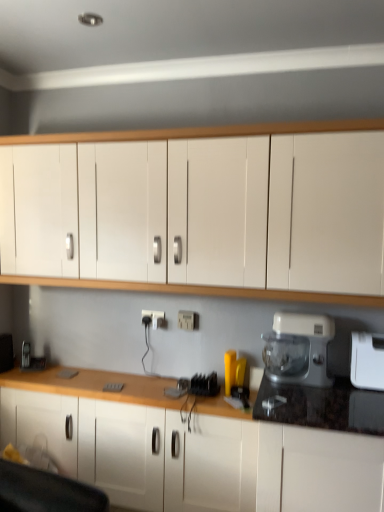
How much space does white plastic electric outlet at center, positioned as the 2th electric outlet in back-to-front order, occupy horizontally?

1.69 inches.

Where is `white plastic electric outlet at center, arranged as the 2th electric outlet when viewed from the right`? white plastic electric outlet at center, arranged as the 2th electric outlet when viewed from the right is located at coordinates (154, 318).

In order to face white plastic food processor at right, should I rotate leftwards or rightwards?

To face it directly, rotate right by 13.960 degrees.

I want to click on white plastic food processor at right, so click(298, 349).

Image resolution: width=384 pixels, height=512 pixels. What do you see at coordinates (189, 448) in the screenshot? I see `white matte cabinet at center, which is counted as the 1th cabinetry, starting from the bottom` at bounding box center [189, 448].

What are the coordinates of `white matte cabinet at upper center, marked as the 2th cabinetry in a bottom-to-top arrangement` in the screenshot? It's located at (229, 215).

At what (x,y) coordinates should I click in order to perform the action: click on white plastic electric outlet at center, which is the 2th electric outlet from left to right. Please return your answer as a coordinate pair (x, y). Looking at the image, I should click on (188, 320).

Is white matte cabinet at center, which is counted as the 2th cabinetry, starting from the top, turned away from white matte cabinet at upper center, marked as the 2th cabinetry in a bottom-to-top arrangement?

That's not correct — white matte cabinet at center, which is counted as the 2th cabinetry, starting from the top, is not looking away from white matte cabinet at upper center, marked as the 2th cabinetry in a bottom-to-top arrangement.

Is white matte cabinet at center, which is counted as the 1th cabinetry, starting from the bottom, far from white matte cabinet at upper center, marked as the 2th cabinetry in a bottom-to-top arrangement?

Actually, white matte cabinet at center, which is counted as the 1th cabinetry, starting from the bottom, and white matte cabinet at upper center, marked as the 2th cabinetry in a bottom-to-top arrangement, are a little close together.

Measure the distance from white matte cabinet at center, which is counted as the 2th cabinetry, starting from the top, to white matte cabinet at upper center, marked as the 2th cabinetry in a bottom-to-top arrangement.

white matte cabinet at center, which is counted as the 2th cabinetry, starting from the top, and white matte cabinet at upper center, marked as the 2th cabinetry in a bottom-to-top arrangement, are 34.29 inches apart.

Does white matte cabinet at center, which is counted as the 2th cabinetry, starting from the top, have a greater height compared to white matte cabinet at upper center, which is the first cabinetry in top-to-bottom order?

In fact, white matte cabinet at center, which is counted as the 2th cabinetry, starting from the top, may be shorter than white matte cabinet at upper center, which is the first cabinetry in top-to-bottom order.

Is white plastic electric outlet at center, the second electric outlet positioned from the front, bigger or smaller than white plastic toaster at right?

In the image, white plastic electric outlet at center, the second electric outlet positioned from the front, appears to be smaller than white plastic toaster at right.

Are white plastic electric outlet at center, the 1th electric outlet viewed from the left, and white plastic toaster at right far apart?

Yes, white plastic electric outlet at center, the 1th electric outlet viewed from the left, and white plastic toaster at right are quite far apart.

Would you say white plastic electric outlet at center, arranged as the 2th electric outlet when viewed from the right, contains white plastic toaster at right?

That's incorrect, white plastic toaster at right is not inside white plastic electric outlet at center, arranged as the 2th electric outlet when viewed from the right.

From the picture: Does white plastic electric outlet at center, arranged as the first electric outlet when viewed from the back, have a greater width compared to white plastic toaster at right?

In fact, white plastic electric outlet at center, arranged as the first electric outlet when viewed from the back, might be narrower than white plastic toaster at right.

Considering the positions of objects white plastic electric outlet at center, arranged as the first electric outlet when viewed from the back, and white plastic electric outlet at center, positioned as the 2th electric outlet in back-to-front order, in the image provided, who is more to the right, white plastic electric outlet at center, arranged as the first electric outlet when viewed from the back, or white plastic electric outlet at center, positioned as the 2th electric outlet in back-to-front order,?

white plastic electric outlet at center, positioned as the 2th electric outlet in back-to-front order, is more to the right.

Is white plastic electric outlet at center, the second electric outlet positioned from the front, completely or partially outside of white plastic electric outlet at center, positioned as the 2th electric outlet in back-to-front order?

Yes, white plastic electric outlet at center, the second electric outlet positioned from the front, is located beyond the bounds of white plastic electric outlet at center, positioned as the 2th electric outlet in back-to-front order.

The width and height of the screenshot is (384, 512). What are the coordinates of `electric outlet positioned vertically above the white plastic electric outlet at center, arranged as the first electric outlet when viewed from the back (from a real-world perspective)` in the screenshot? It's located at (188, 320).

Is white plastic electric outlet at center, the 1th electric outlet viewed from the left, oriented towards white plastic electric outlet at center, which is the 2th electric outlet from left to right?

No, white plastic electric outlet at center, the 1th electric outlet viewed from the left, is not turned towards white plastic electric outlet at center, which is the 2th electric outlet from left to right.

Looking at this image, between white plastic toaster at right and white plastic electric outlet at center, which is the 2th electric outlet from left to right, which one has smaller width?

white plastic electric outlet at center, which is the 2th electric outlet from left to right.

From the image's perspective, between white plastic toaster at right and white plastic electric outlet at center, the 1th electric outlet from the front, which one is located above?

white plastic electric outlet at center, the 1th electric outlet from the front.

Considering the positions of objects white plastic toaster at right and white plastic electric outlet at center, marked as the 1th electric outlet in a right-to-left arrangement, in the image provided, who is more to the left, white plastic toaster at right or white plastic electric outlet at center, marked as the 1th electric outlet in a right-to-left arrangement,?

white plastic electric outlet at center, marked as the 1th electric outlet in a right-to-left arrangement, is more to the left.

Is white plastic toaster at right outside of white plastic electric outlet at center, which is the 2th electric outlet from left to right?

Absolutely, white plastic toaster at right is external to white plastic electric outlet at center, which is the 2th electric outlet from left to right.

Do you think white matte cabinet at center, which is counted as the 2th cabinetry, starting from the top, is within white plastic food processor at right, or outside of it?

white matte cabinet at center, which is counted as the 2th cabinetry, starting from the top, is spatially situated outside white plastic food processor at right.

Is white matte cabinet at center, which is counted as the 2th cabinetry, starting from the top, facing away from white plastic food processor at right?

No, white matte cabinet at center, which is counted as the 2th cabinetry, starting from the top, is not facing away from white plastic food processor at right.

How distant is white matte cabinet at center, which is counted as the 2th cabinetry, starting from the top, from white plastic food processor at right?

The distance of white matte cabinet at center, which is counted as the 2th cabinetry, starting from the top, from white plastic food processor at right is 59.14 centimeters.

Is white matte cabinet at center, which is counted as the 1th cabinetry, starting from the bottom, in front of white plastic food processor at right?

No, white matte cabinet at center, which is counted as the 1th cabinetry, starting from the bottom, is behind white plastic food processor at right.

Is white matte cabinet at upper center, which is the first cabinetry in top-to-bottom order, to the left of white plastic electric outlet at center, marked as the 1th electric outlet in a right-to-left arrangement, from the viewer's perspective?

Indeed, white matte cabinet at upper center, which is the first cabinetry in top-to-bottom order, is positioned on the left side of white plastic electric outlet at center, marked as the 1th electric outlet in a right-to-left arrangement.

Is white matte cabinet at upper center, which is the first cabinetry in top-to-bottom order, beside white plastic electric outlet at center, marked as the 1th electric outlet in a right-to-left arrangement?

They are not placed beside each other.

From a real-world perspective, is white matte cabinet at upper center, marked as the 2th cabinetry in a bottom-to-top arrangement, over white plastic electric outlet at center, marked as the 1th electric outlet in a right-to-left arrangement?

Yes, from a real-world perspective, white matte cabinet at upper center, marked as the 2th cabinetry in a bottom-to-top arrangement, is on top of white plastic electric outlet at center, marked as the 1th electric outlet in a right-to-left arrangement.

At what (x,y) coordinates should I click in order to perform the action: click on electric outlet on the right of white matte cabinet at upper center, which is the first cabinetry in top-to-bottom order. Please return your answer as a coordinate pair (x, y). This screenshot has width=384, height=512. Looking at the image, I should click on (188, 320).

Does white plastic toaster at right turn towards white plastic electric outlet at center, arranged as the first electric outlet when viewed from the back?

No.

Is white plastic toaster at right at the right side of white plastic electric outlet at center, arranged as the first electric outlet when viewed from the back?

Yes.

Which is behind, white plastic toaster at right or white plastic electric outlet at center, arranged as the 2th electric outlet when viewed from the right?

white plastic electric outlet at center, arranged as the 2th electric outlet when viewed from the right, is further from the camera.

Which is behind, point (360, 339) or point (146, 314)?

The point (146, 314) is more distant.

At what (x,y) coordinates should I click in order to perform the action: click on cabinetry in front of the white matte cabinet at center, which is counted as the 2th cabinetry, starting from the top. Please return your answer as a coordinate pair (x, y). The image size is (384, 512). Looking at the image, I should click on 229,215.

Where is `the 2nd electric outlet behind the white plastic toaster at right`? This screenshot has height=512, width=384. the 2nd electric outlet behind the white plastic toaster at right is located at coordinates (154, 318).

Estimate the real-world distances between objects in this image. Which object is closer to white plastic toaster at right, white plastic electric outlet at center, arranged as the first electric outlet when viewed from the back, or white plastic food processor at right?

Among the two, white plastic food processor at right is located nearer to white plastic toaster at right.

When comparing their distances from white plastic electric outlet at center, arranged as the first electric outlet when viewed from the back, does white matte cabinet at center, which is counted as the 1th cabinetry, starting from the bottom, or white plastic electric outlet at center, which is the 2th electric outlet from left to right, seem further?

Based on the image, white matte cabinet at center, which is counted as the 1th cabinetry, starting from the bottom, appears to be further to white plastic electric outlet at center, arranged as the first electric outlet when viewed from the back.

Which object lies further to the anchor point white matte cabinet at center, which is counted as the 2th cabinetry, starting from the top, white plastic food processor at right or white plastic electric outlet at center, positioned as the 2th electric outlet in back-to-front order?

Among the two, white plastic electric outlet at center, positioned as the 2th electric outlet in back-to-front order, is located further to white matte cabinet at center, which is counted as the 2th cabinetry, starting from the top.

When comparing their distances from white matte cabinet at upper center, which is the first cabinetry in top-to-bottom order, does white matte cabinet at center, which is counted as the 2th cabinetry, starting from the top, or white plastic food processor at right seem further?

white matte cabinet at center, which is counted as the 2th cabinetry, starting from the top, is further to white matte cabinet at upper center, which is the first cabinetry in top-to-bottom order.

Which object lies further to the anchor point white plastic electric outlet at center, the 1th electric outlet from the front, white plastic food processor at right or white plastic toaster at right?

white plastic toaster at right is further to white plastic electric outlet at center, the 1th electric outlet from the front.

When comparing their distances from white matte cabinet at center, which is counted as the 1th cabinetry, starting from the bottom, does white plastic electric outlet at center, marked as the 1th electric outlet in a right-to-left arrangement, or white plastic toaster at right seem further?

Among the two, white plastic toaster at right is located further to white matte cabinet at center, which is counted as the 1th cabinetry, starting from the bottom.

Looking at the image, which one is located closer to white matte cabinet at upper center, marked as the 2th cabinetry in a bottom-to-top arrangement, white plastic toaster at right or white matte cabinet at center, which is counted as the 2th cabinetry, starting from the top?

white plastic toaster at right.

Based on their spatial positions, is white matte cabinet at center, which is counted as the 2th cabinetry, starting from the top, or white matte cabinet at upper center, marked as the 2th cabinetry in a bottom-to-top arrangement, closer to white plastic electric outlet at center, arranged as the first electric outlet when viewed from the back?

The object closer to white plastic electric outlet at center, arranged as the first electric outlet when viewed from the back, is white matte cabinet at center, which is counted as the 2th cabinetry, starting from the top.

At what (x,y) coordinates should I click in order to perform the action: click on home appliance between white matte cabinet at center, which is counted as the 2th cabinetry, starting from the top, and white plastic toaster at right from left to right. Please return your answer as a coordinate pair (x, y). The width and height of the screenshot is (384, 512). Looking at the image, I should click on (298, 349).

The image size is (384, 512). Identify the location of home appliance located between white matte cabinet at upper center, which is the first cabinetry in top-to-bottom order, and white plastic toaster at right in the left-right direction. (298, 349).

You are a GUI agent. You are given a task and a screenshot of the screen. Output one action in this format:
    pyautogui.click(x=<x>, y=<y>)
    Task: Click on the cabinetry between white plastic electric outlet at center, the second electric outlet positioned from the front, and white plastic toaster at right, in the horizontal direction
    
    Given the screenshot: What is the action you would take?
    pyautogui.click(x=229, y=215)

This screenshot has height=512, width=384. What are the coordinates of `electric outlet located between white plastic electric outlet at center, the second electric outlet positioned from the front, and white plastic toaster at right in the left-right direction` in the screenshot? It's located at (188, 320).